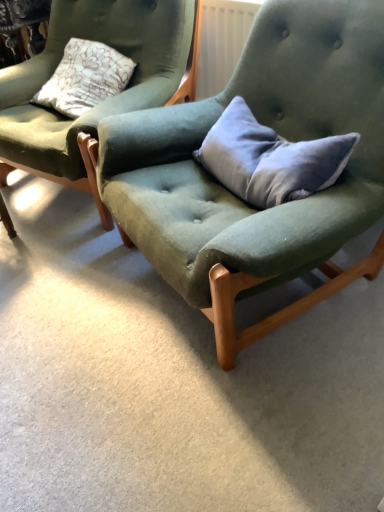
Question: Is gray velvet pillow at center thinner than velvet green chair at center, placed as the 1th chair when sorted from right to left?

Choices:
 (A) no
 (B) yes

Answer: (B)

Question: Is gray velvet pillow at center facing away from velvet green chair at center, placed as the 1th chair when sorted from right to left?

Choices:
 (A) yes
 (B) no

Answer: (A)

Question: Does gray velvet pillow at center appear on the right side of velvet green chair at center, the second chair from the left?

Choices:
 (A) yes
 (B) no

Answer: (A)

Question: Can you confirm if gray velvet pillow at center is bigger than velvet green chair at center, placed as the 1th chair when sorted from right to left?

Choices:
 (A) yes
 (B) no

Answer: (B)

Question: Can you confirm if gray velvet pillow at center is shorter than velvet green chair at center, placed as the 1th chair when sorted from right to left?

Choices:
 (A) no
 (B) yes

Answer: (B)

Question: Relative to gray velvet pillow at center, is velvet green chair at center, placed as the 1th chair when sorted from right to left, in front or behind?

Choices:
 (A) behind
 (B) front

Answer: (B)

Question: Is velvet green chair at center, placed as the 1th chair when sorted from right to left, situated inside gray velvet pillow at center or outside?

Choices:
 (A) outside
 (B) inside

Answer: (A)

Question: Is velvet green chair at center, the second chair from the left, taller or shorter than gray velvet pillow at center?

Choices:
 (A) tall
 (B) short

Answer: (A)

Question: Considering the positions of point (160, 211) and point (253, 150), is point (160, 211) closer or farther from the camera than point (253, 150)?

Choices:
 (A) closer
 (B) farther

Answer: (A)

Question: From a real-world perspective, relative to velvet green chair at center, placed as the 1th chair when sorted from right to left, is gray velvet pillow at center vertically above or below?

Choices:
 (A) below
 (B) above

Answer: (B)

Question: Choose the correct answer: Is gray velvet pillow at center inside velvet green chair at center, placed as the 1th chair when sorted from right to left, or outside it?

Choices:
 (A) outside
 (B) inside

Answer: (B)

Question: In the image, is gray velvet pillow at center positioned in front of or behind velvet green chair at center, the second chair from the left?

Choices:
 (A) behind
 (B) front

Answer: (A)

Question: Considering the relative positions of gray velvet pillow at center and velvet green chair at center, the second chair from the left, in the image provided, is gray velvet pillow at center to the left or to the right of velvet green chair at center, the second chair from the left,?

Choices:
 (A) left
 (B) right

Answer: (B)

Question: From a real-world perspective, is velvet green chair at center, which is counted as the 1th chair, starting from the left, positioned above or below gray velvet pillow at center?

Choices:
 (A) above
 (B) below

Answer: (B)

Question: In the image, is velvet green chair at center, marked as the 2th chair in a right-to-left arrangement, positioned in front of or behind gray velvet pillow at center?

Choices:
 (A) behind
 (B) front

Answer: (A)